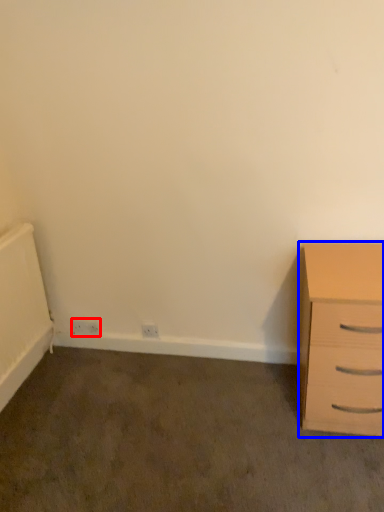
Question: Which object is closer to the camera taking this photo, electric outlet (highlighted by a red box) or chest of drawers (highlighted by a blue box)?

Choices:
 (A) electric outlet
 (B) chest of drawers

Answer: (B)